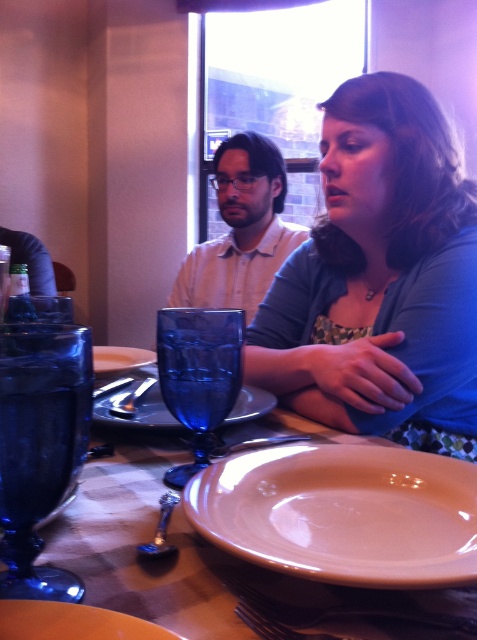
Is matte blue glass at center in front of brushed metal knife at upper left?

Yes, it is in front of brushed metal knife at upper left.

Which is more to the left, matte blue glass at center or brushed metal knife at upper left?

From the viewer's perspective, brushed metal knife at upper left appears more on the left side.

The image size is (477, 640). Identify the location of matte blue glass at center. (208, 561).

Where is `matte blue glass at center`? The height and width of the screenshot is (640, 477). matte blue glass at center is located at coordinates (208, 561).

Is matte orange plate at lower center below matte white plate at center?

Indeed, matte orange plate at lower center is positioned under matte white plate at center.

Describe the element at coordinates (72, 621) in the screenshot. I see `matte orange plate at lower center` at that location.

Identify the location of matte orange plate at lower center. (72, 621).

Locate an element on the screen. This screenshot has height=640, width=477. matte ceramic plate at center is located at coordinates (342, 513).

Is matte ceramic plate at center positioned at the back of matte orange plate at lower center?

Yes, matte ceramic plate at center is further from the viewer.

Identify the location of matte ceramic plate at center. (342, 513).